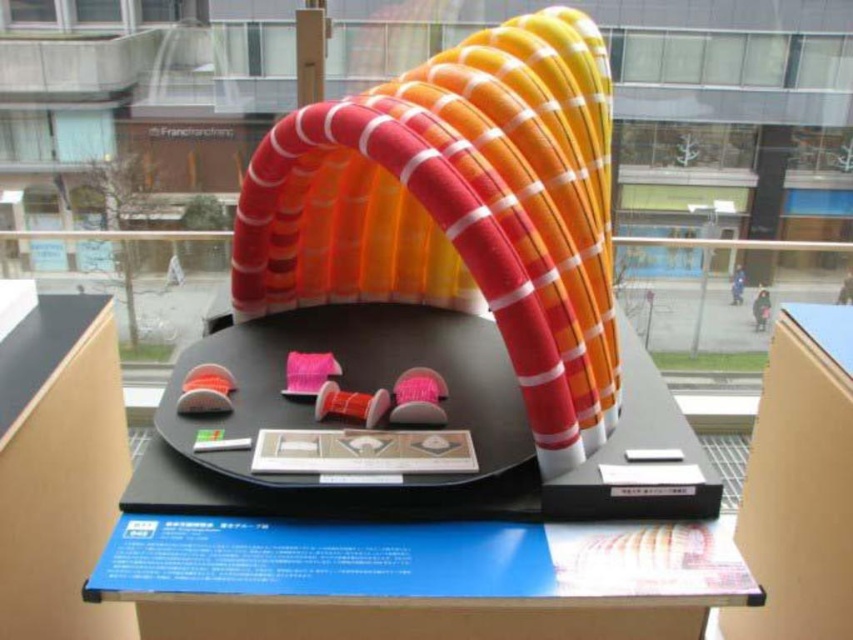
Question: Does pink fuzzy ball at center appear on the right side of matte plastic spool at center?

Choices:
 (A) no
 (B) yes

Answer: (B)

Question: Observing the image, what is the correct spatial positioning of pink fuzzy ball at center in reference to matte plastic spool at center?

Choices:
 (A) below
 (B) above

Answer: (A)

Question: Among these objects, which one is nearest to the camera?

Choices:
 (A) pink fuzzy ball at center
 (B) pink fabric spool at center

Answer: (A)

Question: Among these objects, which one is nearest to the camera?

Choices:
 (A) pink fuzzy ball at center
 (B) pink matte spool at center

Answer: (B)

Question: Does pink matte spool at center appear over pink fabric spool at center?

Choices:
 (A) no
 (B) yes

Answer: (A)

Question: Which object is the closest to the pink fabric spool at center?

Choices:
 (A) black matte table at center
 (B) pink matte spool at center
 (C) matte plastic spool at center
 (D) pink fuzzy ball at center

Answer: (B)